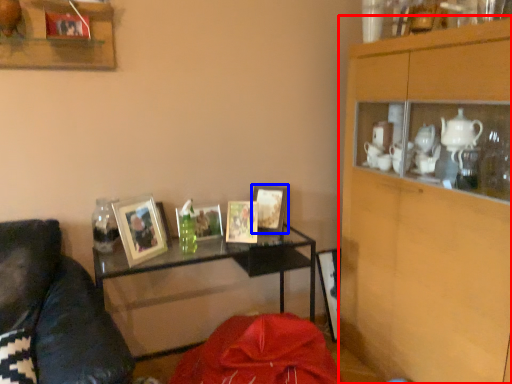
Question: Which object appears closest to the camera in this image, cabinetry (highlighted by a red box) or picture frame (highlighted by a blue box)?

Choices:
 (A) cabinetry
 (B) picture frame

Answer: (A)